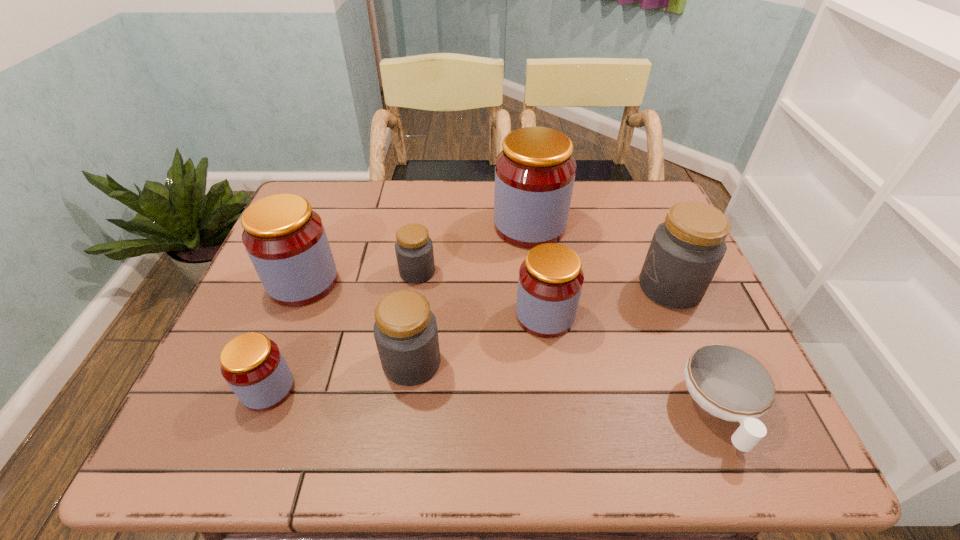
Identify the location of object that ranks as the fourth closest to the farthest jar. (405, 330).

Select which jar appears as the fourth closest to the second biggest red jar. Please provide its 2D coordinates. Your answer should be formatted as a tuple, i.e. [(x, y)], where the tuple contains the x and y coordinates of a point satisfying the conditions above.

[(534, 173)]

This screenshot has height=540, width=960. Identify the location of jar that is the third closest to the third smallest red jar. (405, 330).

Identify which red jar is the second nearest to the biggest gray jar. Please provide its 2D coordinates. Your answer should be formatted as a tuple, i.e. [(x, y)], where the tuple contains the x and y coordinates of a point satisfying the conditions above.

[(550, 281)]

Locate an element on the screen. This screenshot has width=960, height=540. the second closest red jar to the nearest gray jar is located at coordinates (253, 366).

Where is `gray jar identified as the second closest to the biggest red jar`? This screenshot has width=960, height=540. gray jar identified as the second closest to the biggest red jar is located at coordinates (686, 250).

Identify the location of gray jar that stands as the closest to the smallest gray jar. The height and width of the screenshot is (540, 960). (405, 330).

Locate an element on the screen. This screenshot has height=540, width=960. vacant space that satisfies the following two spatial constraints: 1. on the front side of the third smallest red jar; 2. on the right side of the second smallest red jar is located at coordinates (290, 315).

This screenshot has width=960, height=540. I want to click on blank area in the image that satisfies the following two spatial constraints: 1. on the front side of the biggest red jar; 2. on the surface of the smallest gray jar near the warning symbol, so click(536, 272).

The height and width of the screenshot is (540, 960). I want to click on vacant space that satisfies the following two spatial constraints: 1. on the surface of the smallest gray jar near the warning symbol; 2. on the left side of the third biggest red jar, so click(411, 315).